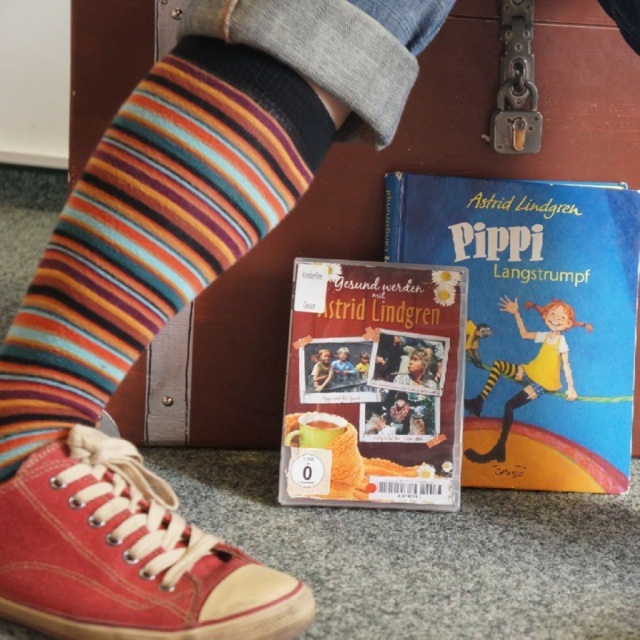
You are organizing a closet and see the smooth blue shirt at center and the matte yellow socks at lower left. Which item is located closer to the bottom of the image?

The matte yellow socks at lower left are closer to the bottom of the image because the smooth blue shirt at center is positioned under them.